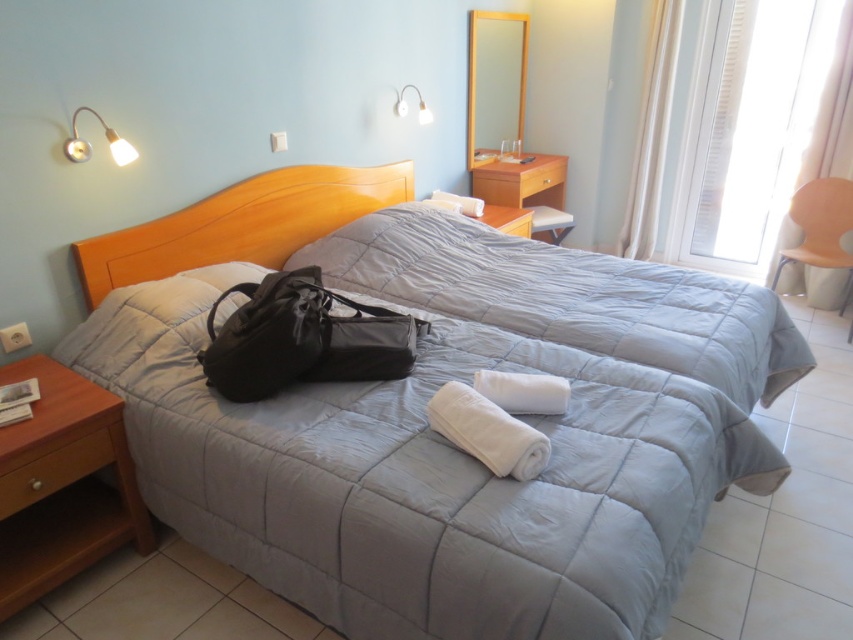
Measure the distance from matte gray quilted bed at center to matte metal lamp at upper left.

matte gray quilted bed at center and matte metal lamp at upper left are 1.11 meters apart.

Between matte gray quilted bed at center and matte metal lamp at upper left, which one appears on the left side from the viewer's perspective?

From the viewer's perspective, matte metal lamp at upper left appears more on the left side.

Between point (155, 337) and point (117, 147), which one is positioned in front?

Positioned in front is point (155, 337).

Locate an element on the screen. The height and width of the screenshot is (640, 853). matte gray quilted bed at center is located at coordinates (422, 413).

Is matte metal lamp at upper left positioned behind white fabric lampshade at upper center?

That is False.

Who is more forward, (103, 132) or (405, 108)?

Point (103, 132) is in front.

Which is in front, point (67, 156) or point (425, 116)?

Point (67, 156) is more forward.

Where is `matte metal lamp at upper left`? Image resolution: width=853 pixels, height=640 pixels. matte metal lamp at upper left is located at coordinates tap(90, 145).

Between point (251, 292) and point (90, 152), which one is positioned in front?

Point (251, 292)

Does black leather bag at center have a greater height compared to matte metal lamp at upper left?

Correct, black leather bag at center is much taller as matte metal lamp at upper left.

What do you see at coordinates (302, 339) in the screenshot?
I see `black leather bag at center` at bounding box center [302, 339].

This screenshot has width=853, height=640. In order to click on black leather bag at center in this screenshot , I will do `click(302, 339)`.